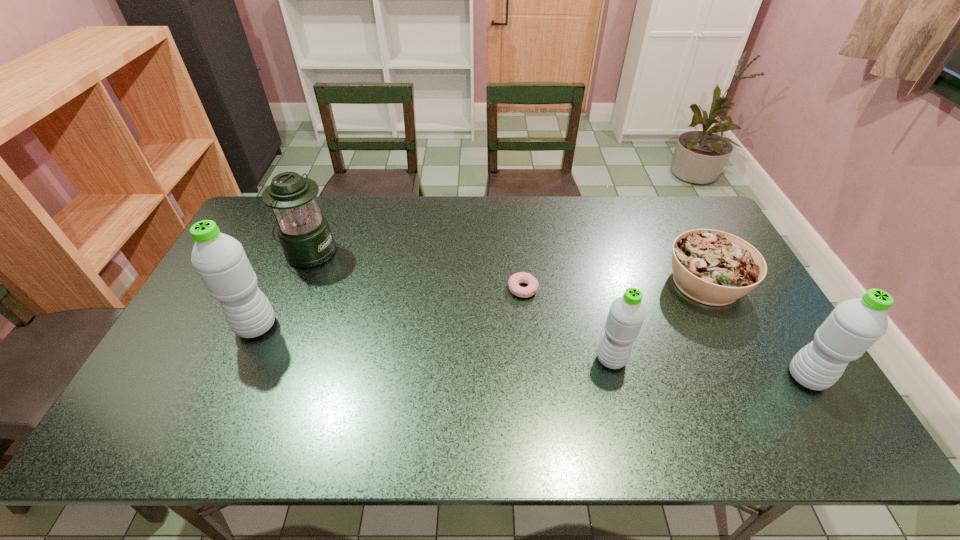
I want to click on vacant space situated 0.350m on the back of the rightmost water bottle, so click(x=740, y=267).

This screenshot has width=960, height=540. In order to click on vacant space situated on the back of the lantern in this screenshot , I will do [x=326, y=211].

Locate an element on the screen. The width and height of the screenshot is (960, 540). vacant region located 0.160m on the right of the shortest object is located at coordinates (592, 289).

Locate an element on the screen. free space located on the front of the salad is located at coordinates (758, 386).

Find the location of a particular element. Image resolution: width=960 pixels, height=540 pixels. object that is positioned at the far edge is located at coordinates (304, 233).

Where is `object positioned at the left edge`? Image resolution: width=960 pixels, height=540 pixels. object positioned at the left edge is located at coordinates (220, 260).

Where is `water bottle present at the right edge`? water bottle present at the right edge is located at coordinates (854, 325).

At what (x,y) coordinates should I click in order to perform the action: click on salad located at the right edge. Please return your answer as a coordinate pair (x, y). Looking at the image, I should click on (712, 267).

Identify the location of object that is at the near right corner. (854, 325).

Locate an element on the screen. The image size is (960, 540). vacant space at the far edge is located at coordinates (638, 208).